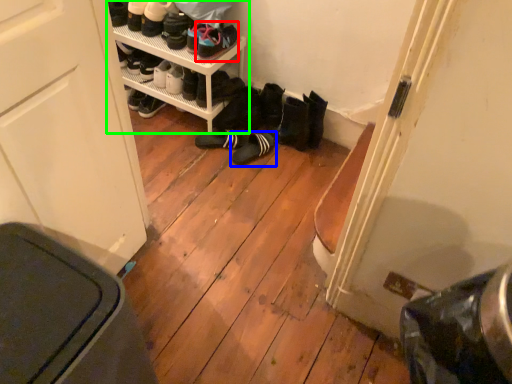
Question: Which is farther away from footwear (highlighted by a red box)? footwear (highlighted by a blue box) or shelf (highlighted by a green box)?

Choices:
 (A) footwear
 (B) shelf

Answer: (A)